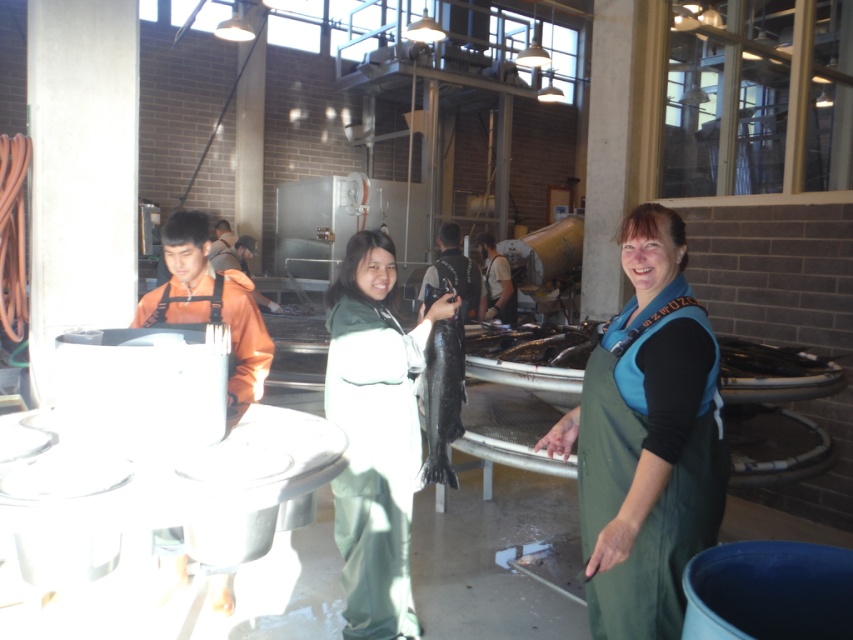
You are a new employee in the fish processing facility. You need to wear a uniform that is wider than the shiny black fish at center. Do you think the green matte uniform at center is suitable for this requirement?

The green matte uniform at center is thinner than the shiny black fish at center, so it is not suitable because it is narrower than the required width.